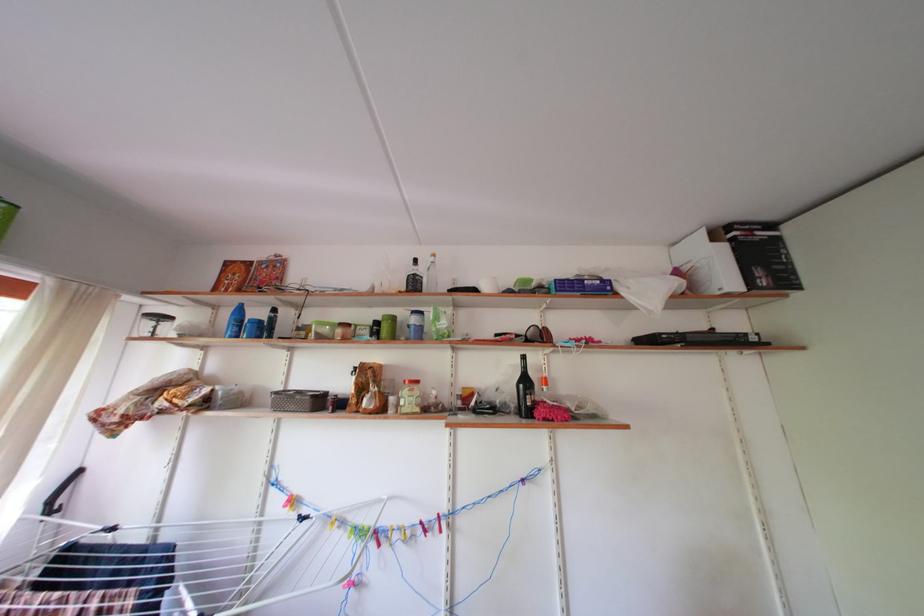
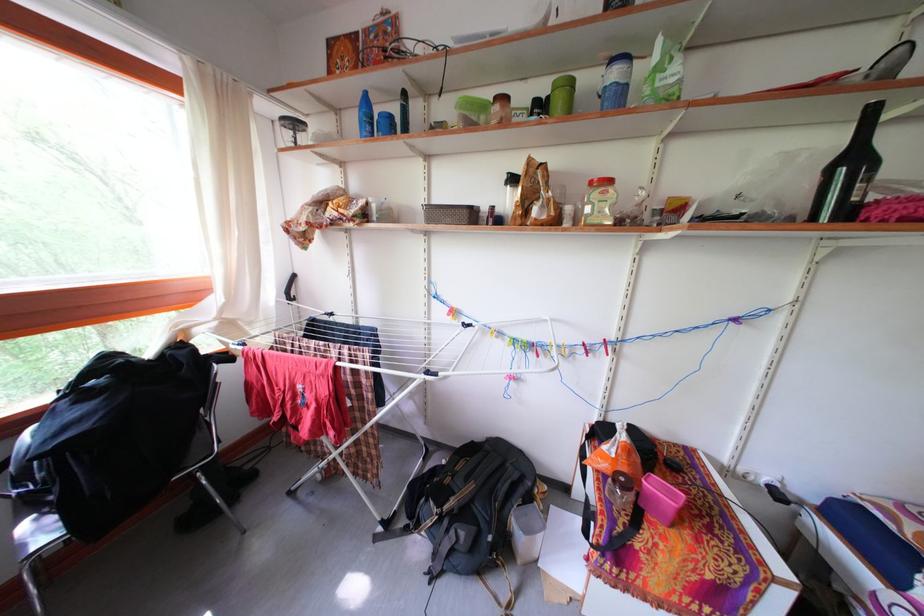
The point at (533, 387) is marked in the first image. Where is the corresponding point in the second image?

(861, 166)